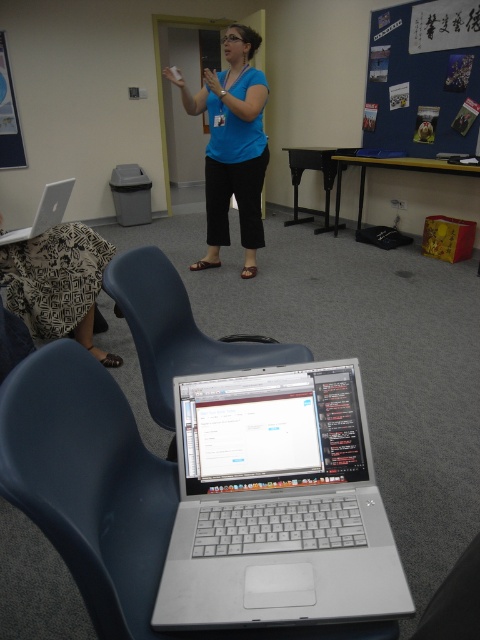
You are an attendee in the meeting room and want to take a photo of the silver metallic laptop at center and the blue fabric bulletin board at upper right. Which object should you focus on first if you want to capture both in a single frame without moving the camera?

You should focus on the silver metallic laptop at center first because it is positioned under the blue fabric bulletin board at upper right, so adjusting the camera angle to include both would require ensuring the laptop is in the lower part of the frame while the bulletin board is at the top.

You are organizing a classroom and need to ensure that the blue fabric bulletin board at upper right and the blue plastic chair at center can fit through a doorway that is 1 meter wide. Based on their sizes, which object is more likely to fit through the doorway without needing to be disassembled?

The blue plastic chair at center is more likely to fit through the doorway without needing to be disassembled because the blue fabric bulletin board at upper right is wider than the blue plastic chair at center, and the doorway is 1 meter wide.